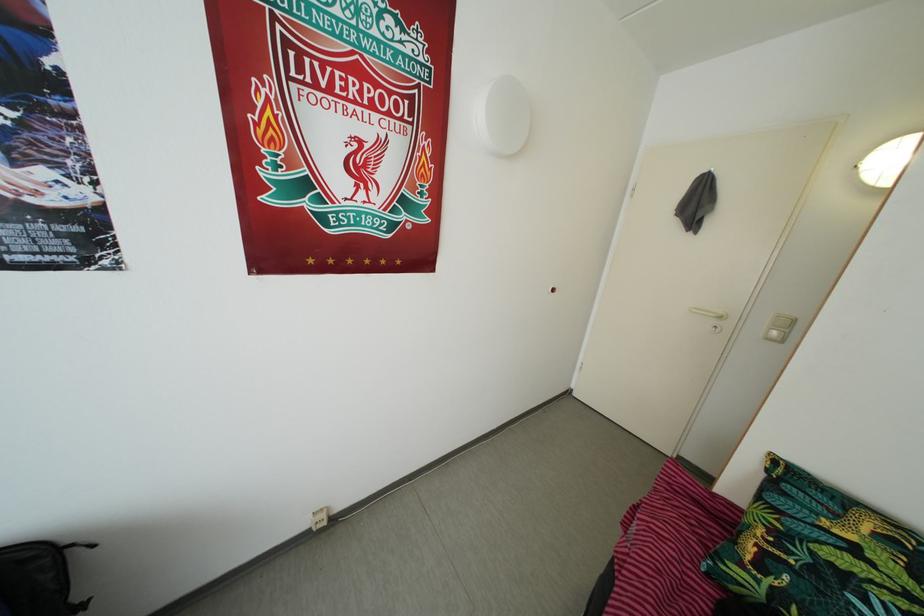
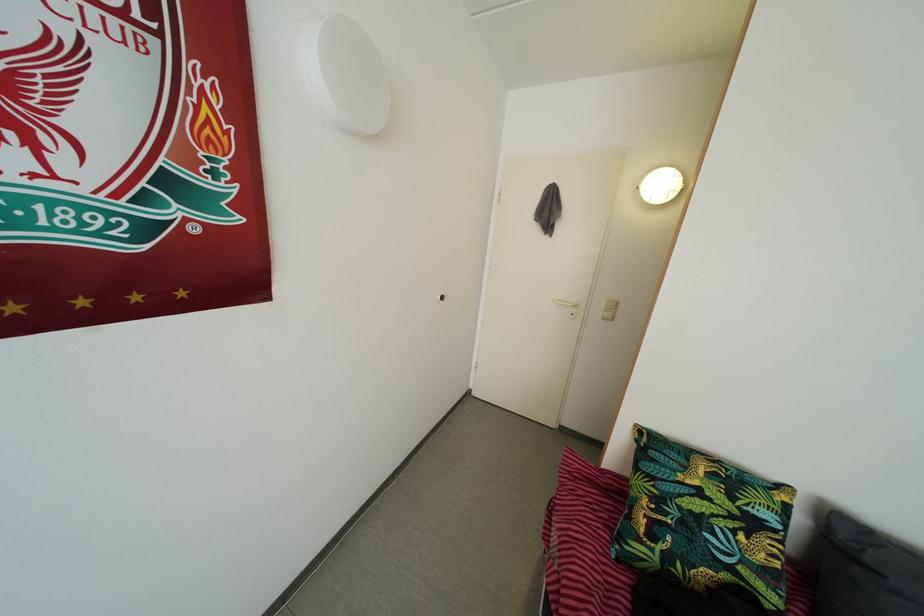
Question: The camera is either moving clockwise (left) or counter-clockwise (right) around the object. The first image is from the beginning of the video and the second image is from the end. Is the camera moving left or right when shooting the video?

Choices:
 (A) Left
 (B) Right

Answer: (A)